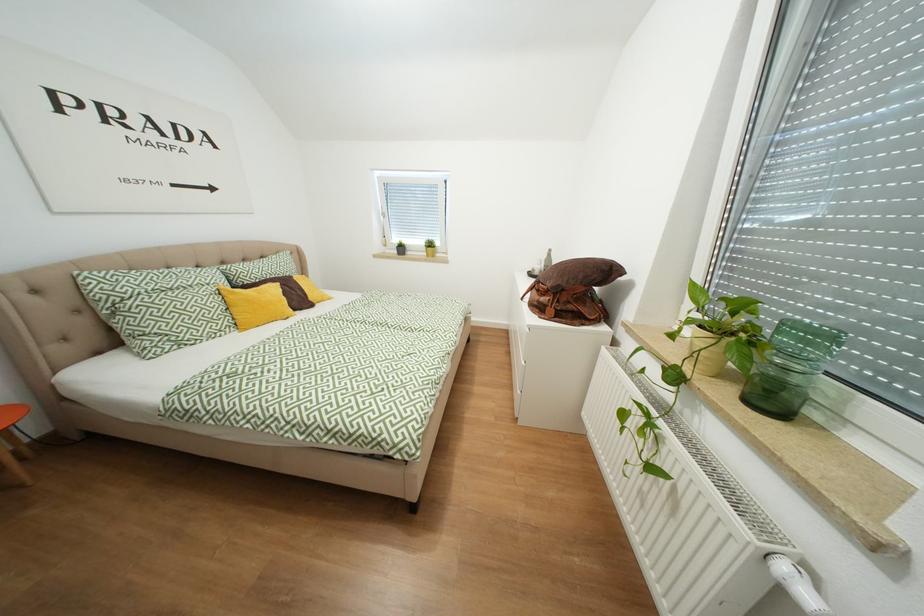
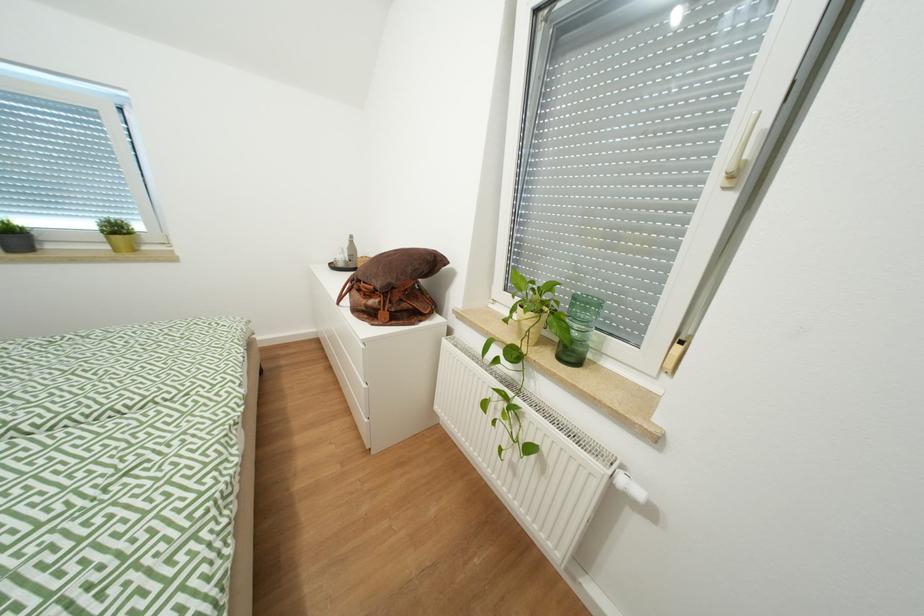
Question: The first image is from the beginning of the video and the second image is from the end. How did the camera likely rotate when shooting the video?

Choices:
 (A) Left
 (B) Right
 (C) Up
 (D) Down

Answer: (B)